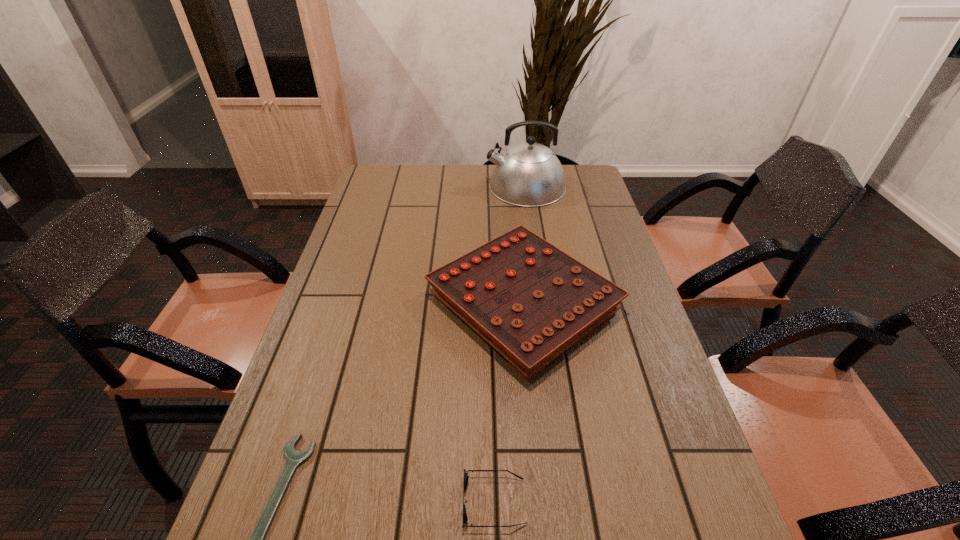
Locate an element on the screen. kettle is located at coordinates (529, 174).

Identify the location of the tallest object. This screenshot has width=960, height=540. (529, 174).

What are the coordinates of `the second tallest object` in the screenshot? It's located at (529, 300).

Find the location of `the second farthest object`. the second farthest object is located at coordinates (529, 300).

The width and height of the screenshot is (960, 540). I want to click on sunglasses, so click(x=465, y=519).

You are a GUI agent. You are given a task and a screenshot of the screen. Output one action in this format:
    pyautogui.click(x=<x>, y=<y>)
    Task: Click on the vacant space located from the spout of the tallest object
    The width and height of the screenshot is (960, 540).
    Given the screenshot: What is the action you would take?
    pyautogui.click(x=470, y=187)

Locate an element on the screen. This screenshot has height=540, width=960. free space located from the spout of the tallest object is located at coordinates (416, 187).

The width and height of the screenshot is (960, 540). Identify the location of vacant space situated 0.160m from the spout of the tallest object. (444, 187).

Identify the location of free space located 0.060m on the front of the third shortest object. This screenshot has height=540, width=960. (534, 410).

Image resolution: width=960 pixels, height=540 pixels. I want to click on free location located 0.310m on the front-facing side of the sunglasses, so click(x=300, y=502).